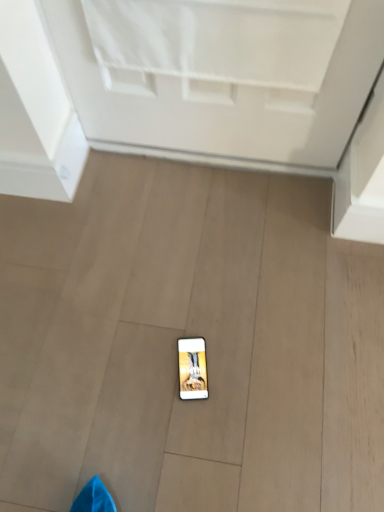
Locate an element on the screen. The height and width of the screenshot is (512, 384). vacant space in front of matte black phone at center is located at coordinates (192, 437).